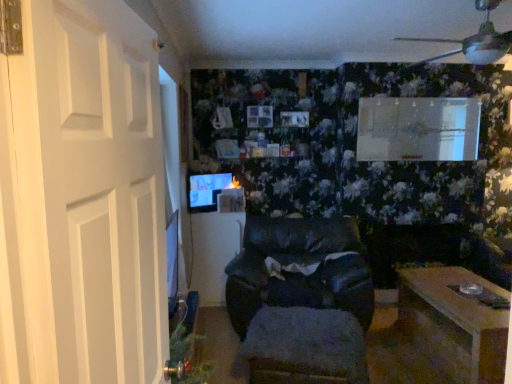
Question: Which direction should I rotate to face wooden coffee table at center, positioned as the 2th table in right-to-left order, — up or down?

Choices:
 (A) up
 (B) down

Answer: (B)

Question: Can you confirm if matte black monitor at center is positioned to the right of white matte door at left?

Choices:
 (A) no
 (B) yes

Answer: (A)

Question: Considering the relative positions of matte black monitor at center and white matte door at left in the image provided, is matte black monitor at center behind white matte door at left?

Choices:
 (A) no
 (B) yes

Answer: (B)

Question: Could white matte door at left be considered to be inside matte black monitor at center?

Choices:
 (A) no
 (B) yes

Answer: (A)

Question: Is matte black monitor at center far away from white matte door at left?

Choices:
 (A) yes
 (B) no

Answer: (A)

Question: Is matte black monitor at center positioned beyond the bounds of white matte door at left?

Choices:
 (A) no
 (B) yes

Answer: (B)

Question: Is matte black monitor at center touching white matte door at left?

Choices:
 (A) yes
 (B) no

Answer: (B)

Question: From the image's perspective, is wooden table at lower right, the 1th table in the front-to-back sequence, located beneath black leather chair at center?

Choices:
 (A) yes
 (B) no

Answer: (A)

Question: Can you confirm if wooden table at lower right, which appears as the second table when viewed from the left, is positioned to the right of black leather chair at center?

Choices:
 (A) yes
 (B) no

Answer: (A)

Question: Is wooden table at lower right, the 1th table in the front-to-back sequence, smaller than black leather chair at center?

Choices:
 (A) no
 (B) yes

Answer: (B)

Question: Considering the relative sizes of wooden table at lower right, which appears as the second table when viewed from the left, and black leather chair at center in the image provided, is wooden table at lower right, which appears as the second table when viewed from the left, thinner than black leather chair at center?

Choices:
 (A) yes
 (B) no

Answer: (B)

Question: From the image's perspective, is wooden table at lower right, which ranks as the second table in back-to-front order, over black leather chair at center?

Choices:
 (A) yes
 (B) no

Answer: (B)

Question: From a real-world perspective, is wooden table at lower right, which ranks as the second table in back-to-front order, below black leather chair at center?

Choices:
 (A) yes
 (B) no

Answer: (A)

Question: Considering the relative sizes of white matte door at left and matte black monitor at center in the image provided, is white matte door at left bigger than matte black monitor at center?

Choices:
 (A) yes
 (B) no

Answer: (A)